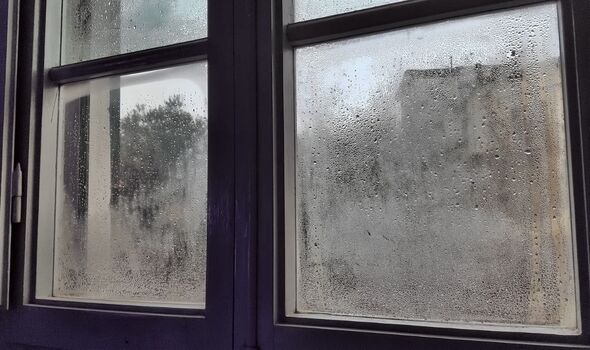
Find the location of `top right window`. top right window is located at coordinates (312, 8).